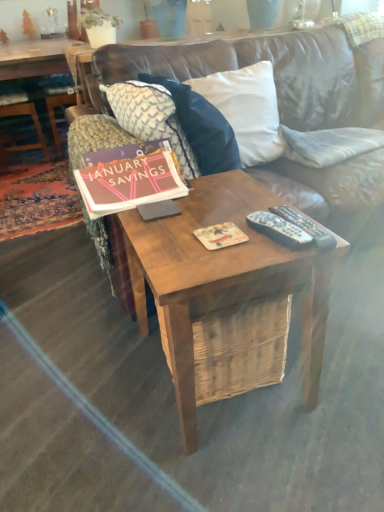
Identify the location of vacant space that is to the left of wooden table at center. The width and height of the screenshot is (384, 512). (84, 386).